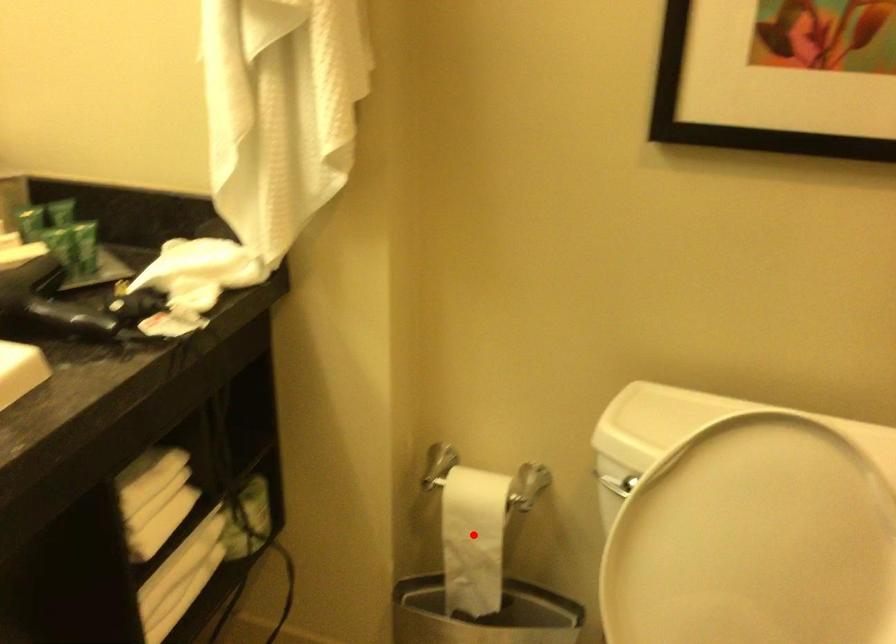
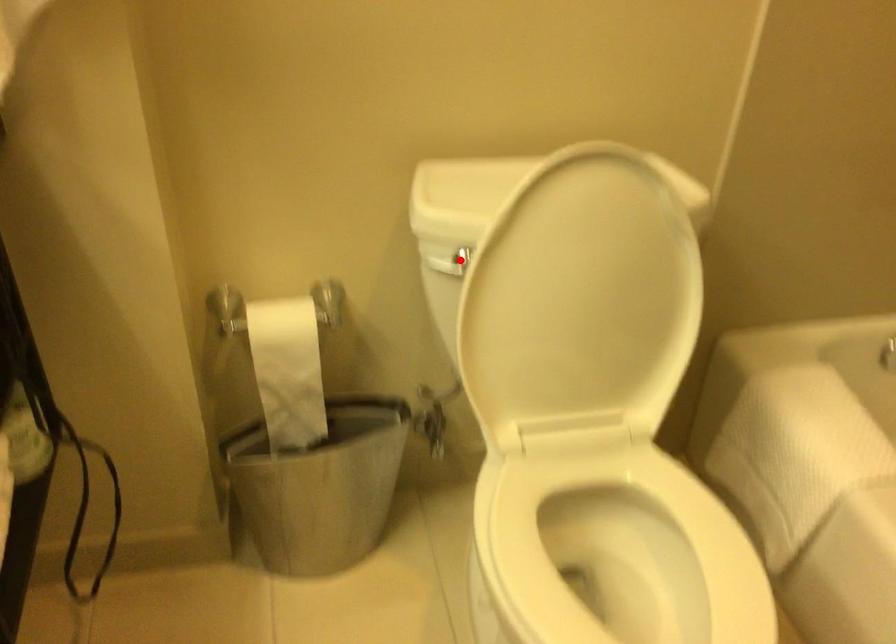
I am providing you with two images of the same scene from different viewpoints. A red point is marked on the first image and another point is marked on the second image. Do the highlighted points in image1 and image2 indicate the same real-world spot?

No